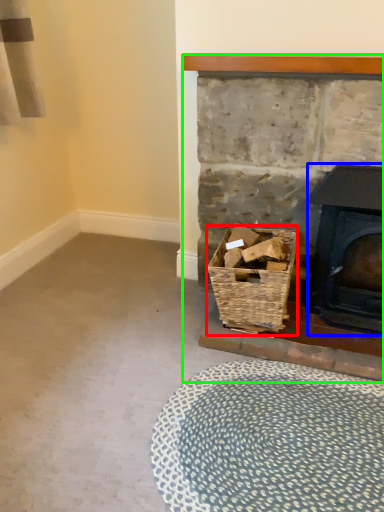
Question: Which object is the farthest from basket (highlighted by a red box)? Choose among these: wood burning stove (highlighted by a blue box) or fireplace (highlighted by a green box).

Choices:
 (A) wood burning stove
 (B) fireplace

Answer: (A)